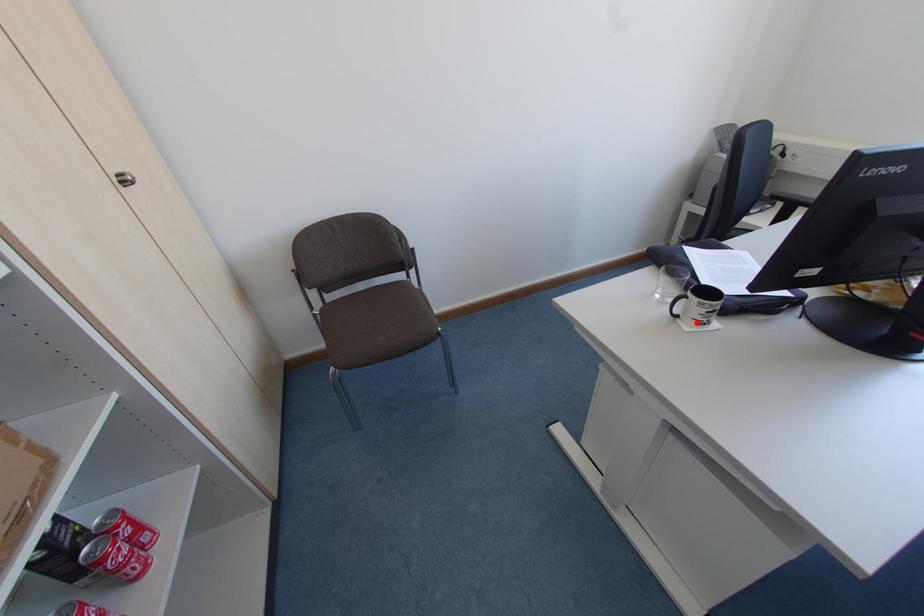
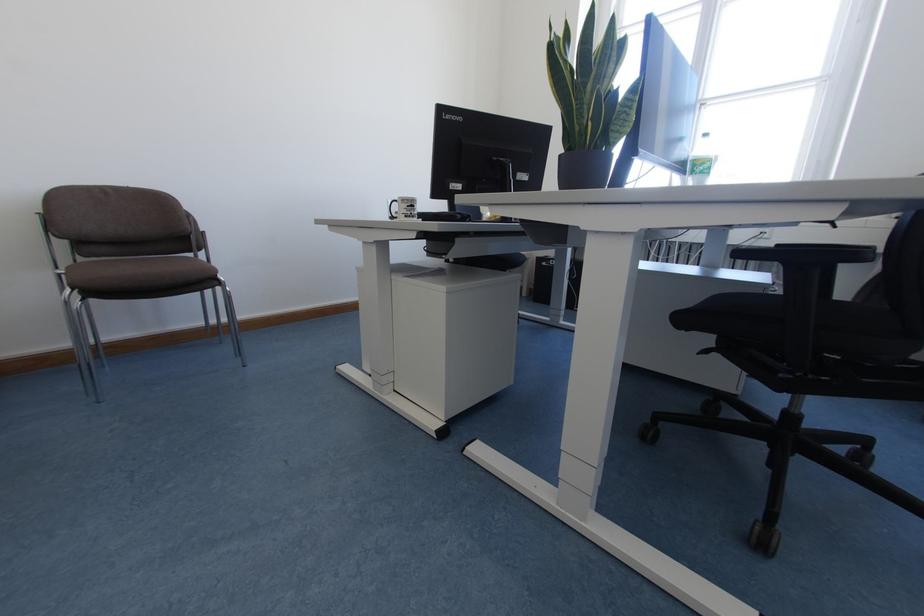
Where in the second image is the point corresponding to the highlighted location from the first image?

(405, 216)